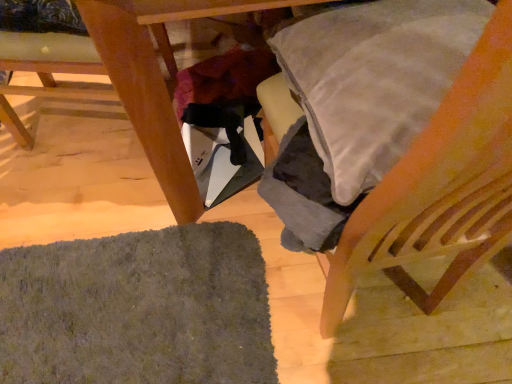
Question: From the image's perspective, is wooden chair at right, the 2th chair viewed from the left, positioned above or below dark gray shaggy mat at lower left?

Choices:
 (A) below
 (B) above

Answer: (B)

Question: Considering the relative positions of wooden chair at right, the 2th chair viewed from the left, and dark gray shaggy mat at lower left in the image provided, is wooden chair at right, the 2th chair viewed from the left, to the left or to the right of dark gray shaggy mat at lower left?

Choices:
 (A) right
 (B) left

Answer: (A)

Question: Which object is positioned closest to the wooden table at lower left?

Choices:
 (A) wooden chair at right, placed as the first chair when sorted from right to left
 (B) dark gray shaggy mat at lower left
 (C) wooden chair at lower left, the 2th chair in the right-to-left sequence

Answer: (B)

Question: Which of these objects is positioned closest to the wooden chair at lower left, the 2th chair in the right-to-left sequence?

Choices:
 (A) dark gray shaggy mat at lower left
 (B) wooden chair at right, placed as the first chair when sorted from right to left
 (C) wooden table at lower left

Answer: (C)